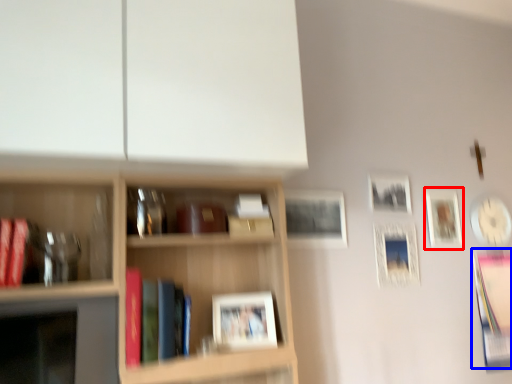
Question: Which object appears closest to the camera in this image, picture frame (highlighted by a red box) or book (highlighted by a blue box)?

Choices:
 (A) picture frame
 (B) book

Answer: (B)